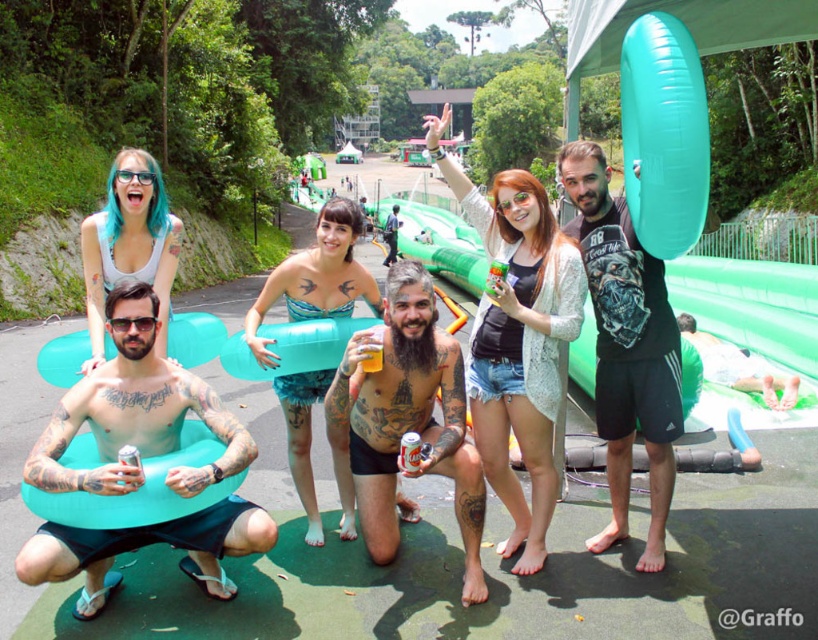
Is point (74, 573) behind point (371, 337)?

No, it is in front of (371, 337).

This screenshot has width=818, height=640. What are the coordinates of `tattooed skin at lower left` in the screenshot? It's located at (135, 412).

The width and height of the screenshot is (818, 640). In order to click on tattooed skin at lower left in this screenshot , I will do `click(135, 412)`.

Based on the photo, can you confirm if tattooed skin at center is taller than translucent yellow glass at center?

Yes.

Is the position of tattooed skin at center less distant than that of translucent yellow glass at center?

Yes, it is.

Is point (387, 362) closer to viewer compared to point (372, 364)?

No, it is not.

This screenshot has width=818, height=640. In order to click on tattooed skin at center in this screenshot , I will do `click(409, 420)`.

Is black matte t-shirt at center positioned at the back of translucent yellow glass at center?

Yes, it is behind translucent yellow glass at center.

Does black matte t-shirt at center have a lesser height compared to translucent yellow glass at center?

In fact, black matte t-shirt at center may be taller than translucent yellow glass at center.

This screenshot has width=818, height=640. Identify the location of black matte t-shirt at center. (627, 346).